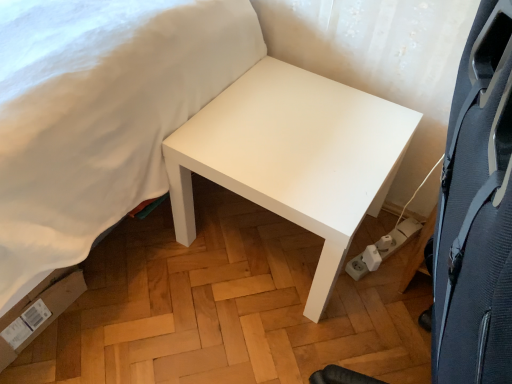
What do you see at coordinates (293, 157) in the screenshot? I see `white matte table at center` at bounding box center [293, 157].

The width and height of the screenshot is (512, 384). Describe the element at coordinates (382, 249) in the screenshot. I see `white plastic socket at lower right` at that location.

Measure the distance between point (376, 246) and camera.

They are 1.47 meters apart.

Find the location of a particular element. The image size is (512, 384). black textured swivel chair at right is located at coordinates (476, 213).

How far apart are black textured swivel chair at right and white matte bed at upper left?

black textured swivel chair at right is 30.76 inches from white matte bed at upper left.

Considering the sizes of black textured swivel chair at right and white matte bed at upper left in the image, is black textured swivel chair at right taller or shorter than white matte bed at upper left?

Considering their sizes, black textured swivel chair at right has more height than white matte bed at upper left.

Is white matte bed at upper left at the back of black textured swivel chair at right?

That's right, black textured swivel chair at right is facing away from white matte bed at upper left.

Is black textured swivel chair at right in front of white matte bed at upper left?

Yes, it is.

Is white plastic socket at lower right completely or partially inside white matte table at center?

No, white plastic socket at lower right is located outside of white matte table at center.

Which object is more forward, white matte table at center or white plastic socket at lower right?

white matte table at center is in front.

Identify the location of table located on the left of white plastic socket at lower right. This screenshot has height=384, width=512. (293, 157).

Are white matte table at center and white plastic socket at lower right making contact?

No.

Can you confirm if white matte bed at upper left is shorter than white plastic socket at lower right?

In fact, white matte bed at upper left may be taller than white plastic socket at lower right.

Is white matte bed at upper left aimed at white plastic socket at lower right?

Yes, white matte bed at upper left is aimed at white plastic socket at lower right.

Considering the points (37, 4) and (359, 267), which point is behind, point (37, 4) or point (359, 267)?

Positioned behind is point (359, 267).

Is white matte bed at upper left not close to white plastic socket at lower right?

No, white matte bed at upper left is not far away from white plastic socket at lower right.

Based on the photo, from a real-world perspective, is black textured swivel chair at right physically below white matte table at center?

No, from a real-world perspective, black textured swivel chair at right is not beneath white matte table at center.

Between black textured swivel chair at right and white matte table at center, which one has smaller width?

black textured swivel chair at right is thinner.

From the image's perspective, is black textured swivel chair at right located above white matte table at center?

No, from the image's perspective, black textured swivel chair at right is not on top of white matte table at center.

Is black textured swivel chair at right facing away from white matte table at center?

black textured swivel chair at right does not have its back to white matte table at center.

Is white plastic socket at lower right closer to the viewer compared to white matte table at center?

No, white plastic socket at lower right is further to the viewer.

Locate an element on the screen. The height and width of the screenshot is (384, 512). electric outlet below the white matte table at center (from a real-world perspective) is located at coordinates (382, 249).

Considering the sizes of white plastic socket at lower right and white matte table at center in the image, is white plastic socket at lower right wider or thinner than white matte table at center?

In the image, white plastic socket at lower right appears to be more narrow than white matte table at center.

How different are the orientations of white plastic socket at lower right and white matte table at center in degrees?

The facing directions of white plastic socket at lower right and white matte table at center are 19.6 degrees apart.

From the image's perspective, relative to black textured swivel chair at right, is white matte bed at upper left above or below?

Clearly, from the image's perspective, white matte bed at upper left is above black textured swivel chair at right.

Is point (64, 223) closer or farther from the camera than point (506, 137)?

Point (64, 223) is positioned farther from the camera compared to point (506, 137).

The width and height of the screenshot is (512, 384). In order to click on swivel chair on the right of white matte bed at upper left in this screenshot , I will do `click(476, 213)`.

In the scene shown: Could black textured swivel chair at right be considered to be inside white plastic socket at lower right?

Actually, black textured swivel chair at right is outside white plastic socket at lower right.

Could you tell me if white plastic socket at lower right is facing black textured swivel chair at right?

Yes, white plastic socket at lower right is turned towards black textured swivel chair at right.

Would you say white plastic socket at lower right is a long distance from black textured swivel chair at right?

They are positioned close to each other.

The image size is (512, 384). Identify the location of electric outlet on the right of black textured swivel chair at right. tap(382, 249).

Where is `swivel chair located below the white matte bed at upper left (from the image's perspective)`? swivel chair located below the white matte bed at upper left (from the image's perspective) is located at coordinates pos(476,213).

In the image, there is a white matte table at center. Where is `electric outlet below it (from a real-world perspective)`? electric outlet below it (from a real-world perspective) is located at coordinates (382, 249).

From the image, which object appears to be nearer to white matte table at center, black textured swivel chair at right or white matte bed at upper left?

white matte bed at upper left is positioned closer to the anchor white matte table at center.

Based on their spatial positions, is black textured swivel chair at right or white plastic socket at lower right further from white matte bed at upper left?

white plastic socket at lower right.

Which object lies further to the anchor point black textured swivel chair at right, white matte bed at upper left or white matte table at center?

The object further to black textured swivel chair at right is white matte bed at upper left.

Looking at the image, which one is located further to white matte bed at upper left, black textured swivel chair at right or white matte table at center?

black textured swivel chair at right is positioned further to the anchor white matte bed at upper left.

Considering their positions, is white matte bed at upper left positioned closer to black textured swivel chair at right than white plastic socket at lower right?

Based on the image, white matte bed at upper left appears to be nearer to black textured swivel chair at right.

From the image, which object appears to be nearer to white plastic socket at lower right, black textured swivel chair at right or white matte bed at upper left?

black textured swivel chair at right.

When comparing their distances from white matte table at center, does black textured swivel chair at right or white plastic socket at lower right seem closer?

white plastic socket at lower right is closer to white matte table at center.

Based on their spatial positions, is white matte bed at upper left or white matte table at center closer to white plastic socket at lower right?

The object closer to white plastic socket at lower right is white matte table at center.

Locate an element on the screen. table between white matte bed at upper left and white plastic socket at lower right in the horizontal direction is located at coordinates (293, 157).

The image size is (512, 384). Identify the location of table between white matte bed at upper left and black textured swivel chair at right. (293, 157).

This screenshot has height=384, width=512. I want to click on table positioned between black textured swivel chair at right and white plastic socket at lower right from near to far, so click(293, 157).

Where is `swivel chair situated between white matte bed at upper left and white plastic socket at lower right from left to right`? The height and width of the screenshot is (384, 512). swivel chair situated between white matte bed at upper left and white plastic socket at lower right from left to right is located at coordinates (476, 213).